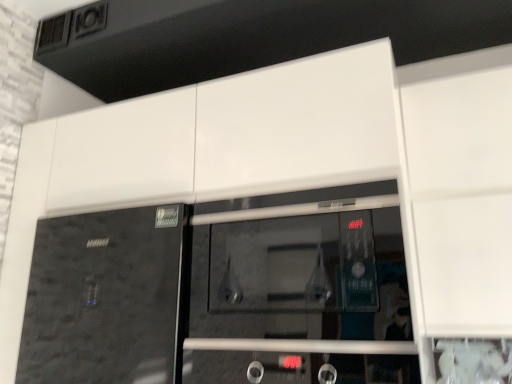
Question: Which is correct: transparent glass microwave at center is inside black glass door at center, or outside of it?

Choices:
 (A) inside
 (B) outside

Answer: (B)

Question: Does point (357, 311) appear closer or farther from the camera than point (74, 248)?

Choices:
 (A) closer
 (B) farther

Answer: (A)

Question: In terms of width, does transparent glass microwave at center look wider or thinner when compared to black glass door at center?

Choices:
 (A) wide
 (B) thin

Answer: (B)

Question: Considering the positions of black glass door at center and transparent glass microwave at center in the image, is black glass door at center bigger or smaller than transparent glass microwave at center?

Choices:
 (A) big
 (B) small

Answer: (A)

Question: In the image, is black glass door at center positioned in front of or behind transparent glass microwave at center?

Choices:
 (A) behind
 (B) front

Answer: (A)

Question: Considering the positions of black glass door at center and transparent glass microwave at center in the image, is black glass door at center wider or thinner than transparent glass microwave at center?

Choices:
 (A) thin
 (B) wide

Answer: (B)

Question: Based on their positions, is black glass door at center located to the left or right of transparent glass microwave at center?

Choices:
 (A) left
 (B) right

Answer: (A)